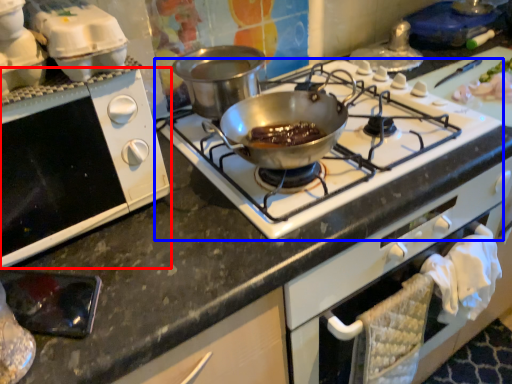
Question: Which object is further to the camera taking this photo, oven (highlighted by a red box) or gas stove (highlighted by a blue box)?

Choices:
 (A) oven
 (B) gas stove

Answer: (B)